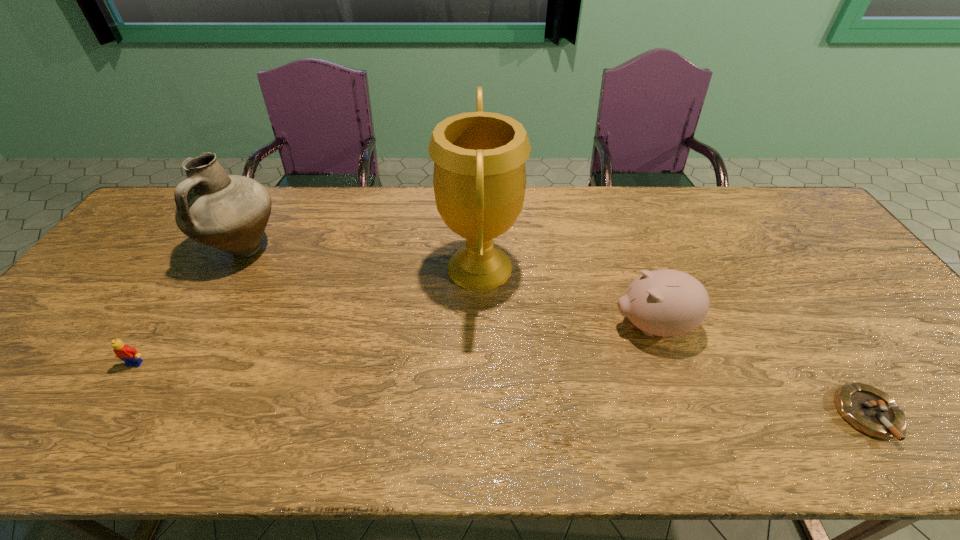
Locate an element on the screen. free space in the image that satisfies the following two spatial constraints: 1. at the snout of the piggy bank; 2. on the face of the second nearest object is located at coordinates (665, 363).

The height and width of the screenshot is (540, 960). Identify the location of vacant space that satisfies the following two spatial constraints: 1. on the face of the rightmost object; 2. on the left side of the second shortest object. (102, 415).

At what (x,y) coordinates should I click in order to perform the action: click on free location that satisfies the following two spatial constraints: 1. on the face of the Lego; 2. on the right side of the nearest object. Please return your answer as a coordinate pair (x, y). The image size is (960, 540). Looking at the image, I should click on (102, 415).